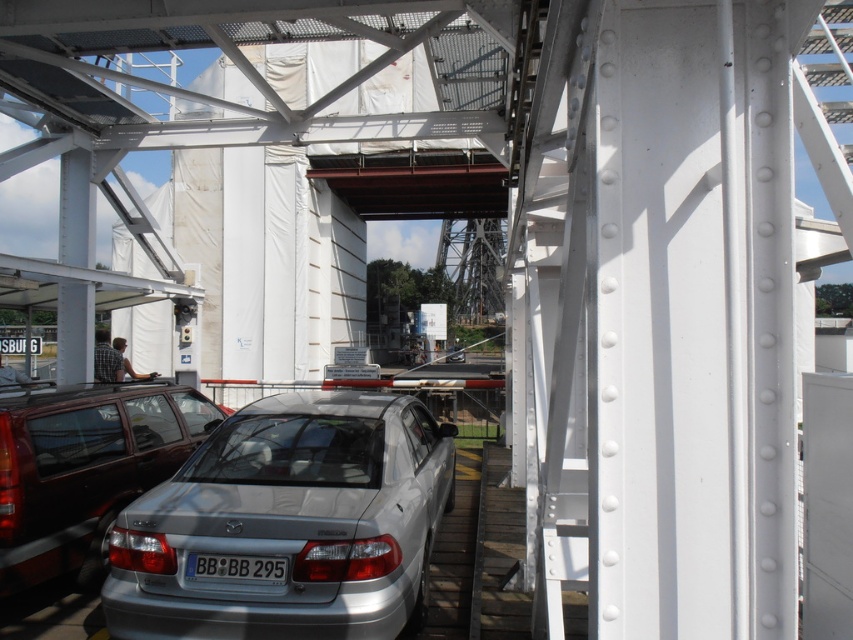
Question: Which object is positioned farthest from the silver metallic car at center?

Choices:
 (A) white plastic license plate at center
 (B) satin silver sedan at lower center

Answer: (B)

Question: Which of the following is the farthest from the observer?

Choices:
 (A) (219, 577)
 (B) (316, 582)

Answer: (A)

Question: Does silver metallic car at center have a larger size compared to white plastic license plate at center?

Choices:
 (A) no
 (B) yes

Answer: (B)

Question: Which object is the closest to the silver metallic car at center?

Choices:
 (A) satin silver sedan at lower center
 (B) white plastic license plate at center

Answer: (B)

Question: Can you confirm if satin silver sedan at lower center is thinner than white plastic license plate at center?

Choices:
 (A) no
 (B) yes

Answer: (A)

Question: Is silver metallic car at center positioned in front of white plastic license plate at center?

Choices:
 (A) yes
 (B) no

Answer: (A)